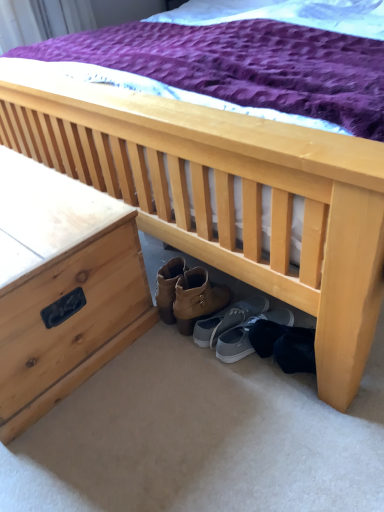
Question: Would you say gray fabric shoe at lower center, which is the 1th footwear from right to left, is to the left or to the right of gray suede shoes at center, the second footwear from the right, in the picture?

Choices:
 (A) right
 (B) left

Answer: (A)

Question: Considering the positions of gray fabric shoe at lower center, which is the 1th footwear from right to left, and gray suede shoes at center, the first footwear when ordered from left to right, in the image, is gray fabric shoe at lower center, which is the 1th footwear from right to left, bigger or smaller than gray suede shoes at center, the first footwear when ordered from left to right,?

Choices:
 (A) big
 (B) small

Answer: (A)

Question: Considering the real-world distances, which object is closest to the natural wood nightstand at left?

Choices:
 (A) gray fabric shoe at lower center, which is the second footwear in left-to-right order
 (B) gray suede shoes at center, the second footwear from the right

Answer: (B)

Question: Which is nearer to the gray fabric shoe at lower center, which is the second footwear in left-to-right order?

Choices:
 (A) gray suede shoes at center, the first footwear when ordered from left to right
 (B) natural wood nightstand at left

Answer: (A)